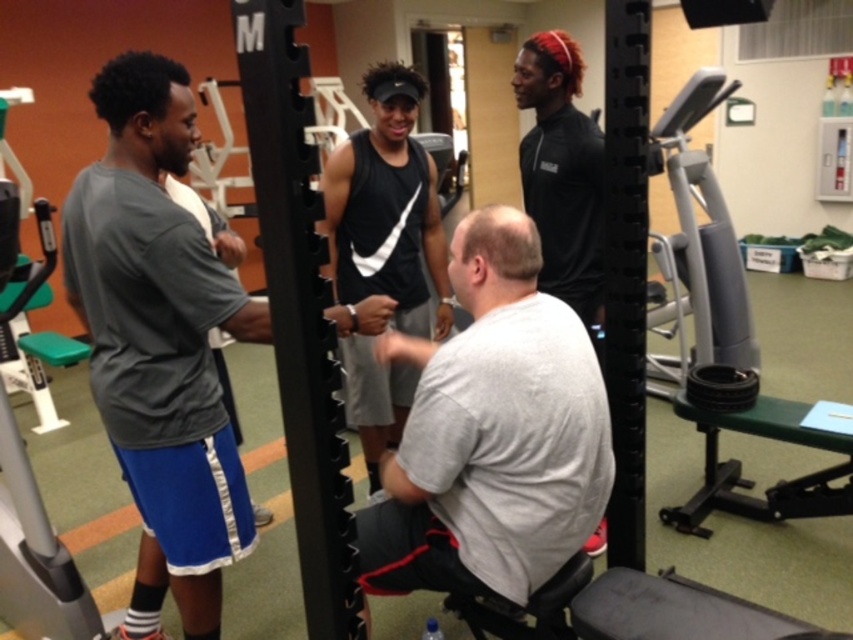
Who is higher up, gray fabric shirt at left or black matte tank top at center?

black matte tank top at center is above.

What do you see at coordinates (160, 342) in the screenshot? The image size is (853, 640). I see `gray fabric shirt at left` at bounding box center [160, 342].

Between point (144, 378) and point (421, 256), which one is positioned in front?

Point (144, 378) is more forward.

Where is `gray fabric shirt at left`? The image size is (853, 640). gray fabric shirt at left is located at coordinates (160, 342).

Can you confirm if gray fabric shirt at left is thinner than gray fabric squat at center?

Yes, gray fabric shirt at left is thinner than gray fabric squat at center.

Can you confirm if gray fabric shirt at left is positioned below gray fabric squat at center?

No, gray fabric shirt at left is not below gray fabric squat at center.

Locate an element on the screen. gray fabric shirt at left is located at coordinates [160, 342].

I want to click on gray fabric shirt at left, so click(x=160, y=342).

Who is positioned more to the left, gray fabric shirt at left or black matte shirt at upper right?

gray fabric shirt at left

Is gray fabric shirt at left bigger than black matte shirt at upper right?

Indeed, gray fabric shirt at left has a larger size compared to black matte shirt at upper right.

Where is `gray fabric shirt at left`? The width and height of the screenshot is (853, 640). gray fabric shirt at left is located at coordinates (160, 342).

At what (x,y) coordinates should I click in order to perform the action: click on gray fabric shirt at left. Please return your answer as a coordinate pair (x, y). The height and width of the screenshot is (640, 853). Looking at the image, I should click on (160, 342).